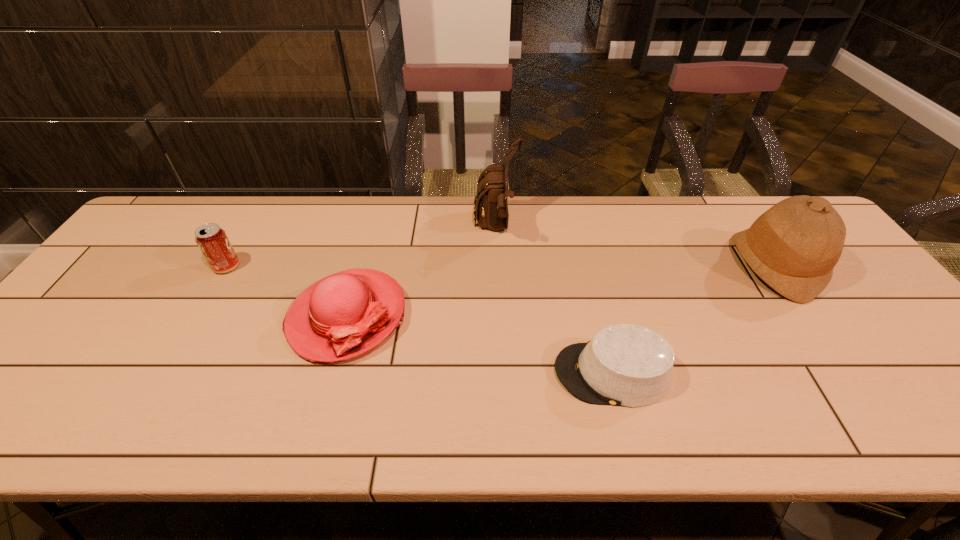
Identify which object is the third nearest to the tallest hat. Please provide its 2D coordinates. Your answer should be formatted as a tuple, i.e. [(x, y)], where the tuple contains the x and y coordinates of a point satisfying the conditions above.

[(344, 315)]

Identify the location of the closest object to the second object from left to right. (490, 205).

Point out which hat is positioned as the second nearest to the shortest object. Please provide its 2D coordinates. Your answer should be formatted as a tuple, i.e. [(x, y)], where the tuple contains the x and y coordinates of a point satisfying the conditions above.

[(344, 315)]

Locate an element on the screen. The image size is (960, 540). hat that can be found as the closest to the second object from right to left is located at coordinates (793, 247).

In order to click on free spot that satisfies the following two spatial constraints: 1. on the front-facing side of the rightmost hat; 2. on the front side of the leftmost object in this screenshot , I will do `click(776, 266)`.